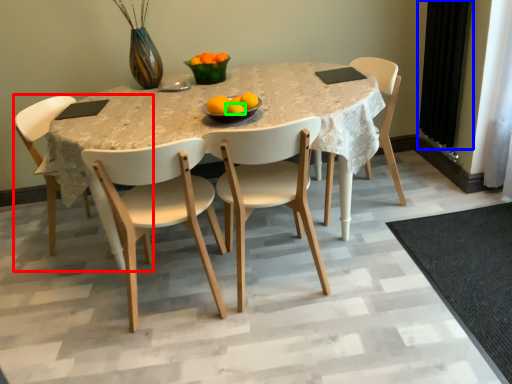
Question: Estimate the real-world distances between objects in this image. Which object is closer to chair (highlighted by a red box), curtain (highlighted by a blue box) or orange (highlighted by a green box)?

Choices:
 (A) curtain
 (B) orange

Answer: (B)